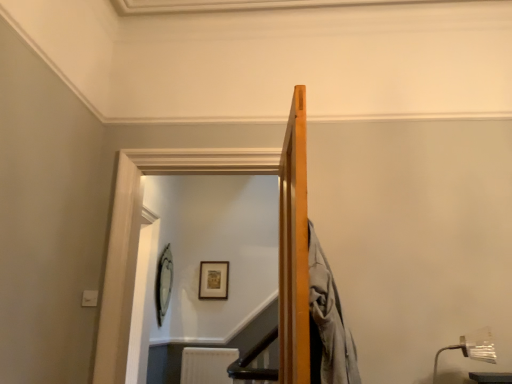
Where is `wooden picture frame at upper center, which ranks as the 2th picture frame in left-to-right order`? wooden picture frame at upper center, which ranks as the 2th picture frame in left-to-right order is located at coordinates (213, 280).

The width and height of the screenshot is (512, 384). What do you see at coordinates (164, 283) in the screenshot? I see `silver metallic picture frame at upper center, which is the second picture frame from right to left` at bounding box center [164, 283].

You are a GUI agent. You are given a task and a screenshot of the screen. Output one action in this format:
    pyautogui.click(x=<x>, y=<y>)
    Task: Click on the clear glass door at upper center
    
    Given the screenshot: What is the action you would take?
    pyautogui.click(x=203, y=260)

Which of these two, clear glass door at upper center or silver metallic picture frame at upper center, arranged as the first picture frame when viewed from the left, is thinner?

Thinner between the two is silver metallic picture frame at upper center, arranged as the first picture frame when viewed from the left.

Between clear glass door at upper center and silver metallic picture frame at upper center, which is the second picture frame from right to left, which one appears on the right side from the viewer's perspective?

From the viewer's perspective, clear glass door at upper center appears more on the right side.

Would you say clear glass door at upper center is outside silver metallic picture frame at upper center, which is the second picture frame from right to left?

Absolutely, clear glass door at upper center is external to silver metallic picture frame at upper center, which is the second picture frame from right to left.

Could you tell me if clear glass door at upper center is turned towards silver metallic picture frame at upper center, arranged as the first picture frame when viewed from the left?

No.

From a real-world perspective, which is physically below, silver metallic picture frame at upper center, arranged as the first picture frame when viewed from the left, or metallic silver lamp at lower right?

metallic silver lamp at lower right, from a real-world perspective.

Can you confirm if silver metallic picture frame at upper center, which is the second picture frame from right to left, is smaller than metallic silver lamp at lower right?

Actually, silver metallic picture frame at upper center, which is the second picture frame from right to left, might be larger than metallic silver lamp at lower right.

Which of these two, silver metallic picture frame at upper center, arranged as the first picture frame when viewed from the left, or metallic silver lamp at lower right, stands shorter?

metallic silver lamp at lower right.

From a real-world perspective, which is physically above, wooden picture frame at upper center, which ranks as the 2th picture frame in left-to-right order, or silver metallic picture frame at upper center, which is the second picture frame from right to left?

From a 3D spatial view, wooden picture frame at upper center, which ranks as the 2th picture frame in left-to-right order, is above.

Which object is positioned more to the left, wooden picture frame at upper center, which is counted as the 1th picture frame, starting from the right, or silver metallic picture frame at upper center, which is the second picture frame from right to left?

From the viewer's perspective, silver metallic picture frame at upper center, which is the second picture frame from right to left, appears more on the left side.

Is point (210, 286) positioned in front of point (172, 266)?

No, it is not.

Is wooden picture frame at upper center, which ranks as the 2th picture frame in left-to-right order, turned away from silver metallic picture frame at upper center, which is the second picture frame from right to left?

No.

Which is in front, point (460, 341) or point (169, 247)?

The point (460, 341) is closer to the camera.

Considering the relative sizes of metallic silver lamp at lower right and silver metallic picture frame at upper center, arranged as the first picture frame when viewed from the left, in the image provided, is metallic silver lamp at lower right smaller than silver metallic picture frame at upper center, arranged as the first picture frame when viewed from the left,?

Yes.

What's the angular difference between metallic silver lamp at lower right and silver metallic picture frame at upper center, arranged as the first picture frame when viewed from the left,'s facing directions?

The angle between the facing direction of metallic silver lamp at lower right and the facing direction of silver metallic picture frame at upper center, arranged as the first picture frame when viewed from the left, is 80.6 degrees.

Which of these two, metallic silver lamp at lower right or silver metallic picture frame at upper center, which is the second picture frame from right to left, is wider?

With larger width is metallic silver lamp at lower right.

Is the position of clear glass door at upper center less distant than that of white textured radiator at lower center?

Yes, the depth of clear glass door at upper center is less than that of white textured radiator at lower center.

Does point (143, 242) come closer to viewer compared to point (192, 381)?

Yes, point (143, 242) is closer to viewer.

Is clear glass door at upper center facing away from white textured radiator at lower center?

Yes.

Is the surface of clear glass door at upper center in direct contact with metallic silver lamp at lower right?

No, clear glass door at upper center is not next to metallic silver lamp at lower right.

Which is in front, clear glass door at upper center or metallic silver lamp at lower right?

Positioned in front is metallic silver lamp at lower right.

Considering the sizes of objects clear glass door at upper center and metallic silver lamp at lower right in the image provided, who is shorter, clear glass door at upper center or metallic silver lamp at lower right?

Result: metallic silver lamp at lower right.

From a real-world perspective, who is located lower, clear glass door at upper center or metallic silver lamp at lower right?

metallic silver lamp at lower right.

Between point (209, 294) and point (272, 235), which one is positioned behind?

The point (272, 235) is more distant.

Can you see wooden picture frame at upper center, which is counted as the 1th picture frame, starting from the right, touching clear glass door at upper center?

They are not placed beside each other.

What's the angular difference between wooden picture frame at upper center, which is counted as the 1th picture frame, starting from the right, and clear glass door at upper center's facing directions?

wooden picture frame at upper center, which is counted as the 1th picture frame, starting from the right, and clear glass door at upper center are facing 0.0299 degrees away from each other.

Consider the image. Which of these two, wooden picture frame at upper center, which ranks as the 2th picture frame in left-to-right order, or clear glass door at upper center, stands taller?

With more height is clear glass door at upper center.

The image size is (512, 384). Identify the location of glass door that appears below the silver metallic picture frame at upper center, arranged as the first picture frame when viewed from the left (from a real-world perspective). (203, 260).

This screenshot has height=384, width=512. There is a metallic silver lamp at lower right. What are the coordinates of `the 1st picture frame above it (from a real-world perspective)` in the screenshot? It's located at (164, 283).

From the image, which object appears to be farther from metallic silver lamp at lower right, silver metallic picture frame at upper center, arranged as the first picture frame when viewed from the left, or clear glass door at upper center?

silver metallic picture frame at upper center, arranged as the first picture frame when viewed from the left.

From the picture: Looking at the image, which one is located closer to silver metallic picture frame at upper center, which is the second picture frame from right to left, white textured radiator at lower center or wooden picture frame at upper center, which is counted as the 1th picture frame, starting from the right?

wooden picture frame at upper center, which is counted as the 1th picture frame, starting from the right, is positioned closer to the anchor silver metallic picture frame at upper center, which is the second picture frame from right to left.

Based on the photo, when comparing their distances from metallic silver lamp at lower right, does white textured radiator at lower center or clear glass door at upper center seem closer?

clear glass door at upper center lies closer to metallic silver lamp at lower right than the other object.

When comparing their distances from metallic silver lamp at lower right, does clear glass door at upper center or white textured radiator at lower center seem further?

The object further to metallic silver lamp at lower right is white textured radiator at lower center.

When comparing their distances from wooden picture frame at upper center, which is counted as the 1th picture frame, starting from the right, does clear glass door at upper center or silver metallic picture frame at upper center, arranged as the first picture frame when viewed from the left, seem closer?

silver metallic picture frame at upper center, arranged as the first picture frame when viewed from the left.

Considering their positions, is white textured radiator at lower center positioned closer to clear glass door at upper center than metallic silver lamp at lower right?

Answer: white textured radiator at lower center lies closer to clear glass door at upper center than the other object.

From the image, which object appears to be nearer to metallic silver lamp at lower right, clear glass door at upper center or silver metallic picture frame at upper center, arranged as the first picture frame when viewed from the left?

clear glass door at upper center lies closer to metallic silver lamp at lower right than the other object.

Based on their spatial positions, is wooden picture frame at upper center, which ranks as the 2th picture frame in left-to-right order, or metallic silver lamp at lower right closer to silver metallic picture frame at upper center, which is the second picture frame from right to left?

wooden picture frame at upper center, which ranks as the 2th picture frame in left-to-right order, lies closer to silver metallic picture frame at upper center, which is the second picture frame from right to left, than the other object.

Where is `picture frame located between metallic silver lamp at lower right and white textured radiator at lower center in the depth direction`? picture frame located between metallic silver lamp at lower right and white textured radiator at lower center in the depth direction is located at coordinates (164, 283).

Locate an element on the screen. The image size is (512, 384). picture frame that lies between silver metallic picture frame at upper center, which is the second picture frame from right to left, and white textured radiator at lower center from top to bottom is located at coordinates (213, 280).

Locate an element on the screen. The image size is (512, 384). picture frame positioned between clear glass door at upper center and white textured radiator at lower center from near to far is located at coordinates (164, 283).

At what (x,y) coordinates should I click in order to perform the action: click on radiator between clear glass door at upper center and wooden picture frame at upper center, which is counted as the 1th picture frame, starting from the right, from front to back. Please return your answer as a coordinate pair (x, y). The image size is (512, 384). Looking at the image, I should click on (207, 365).